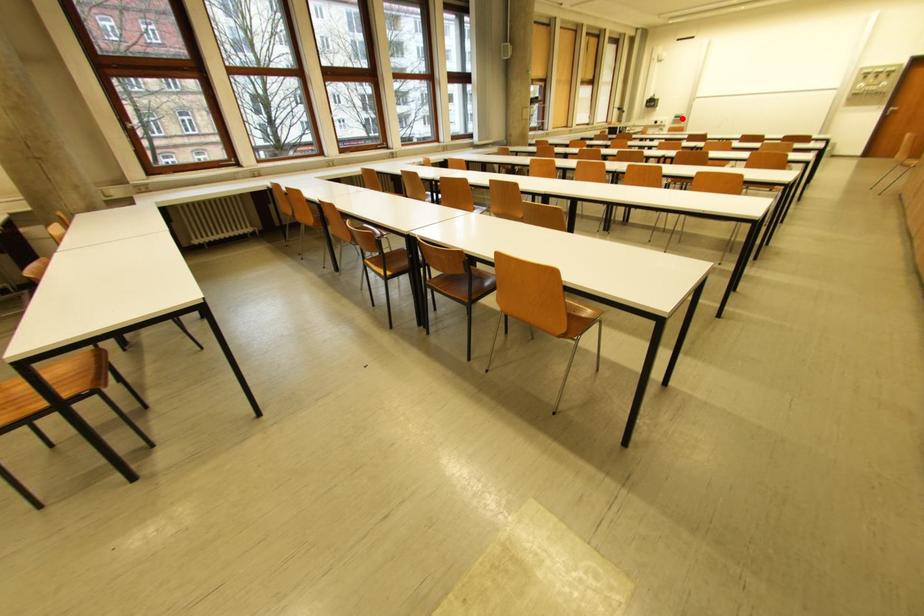
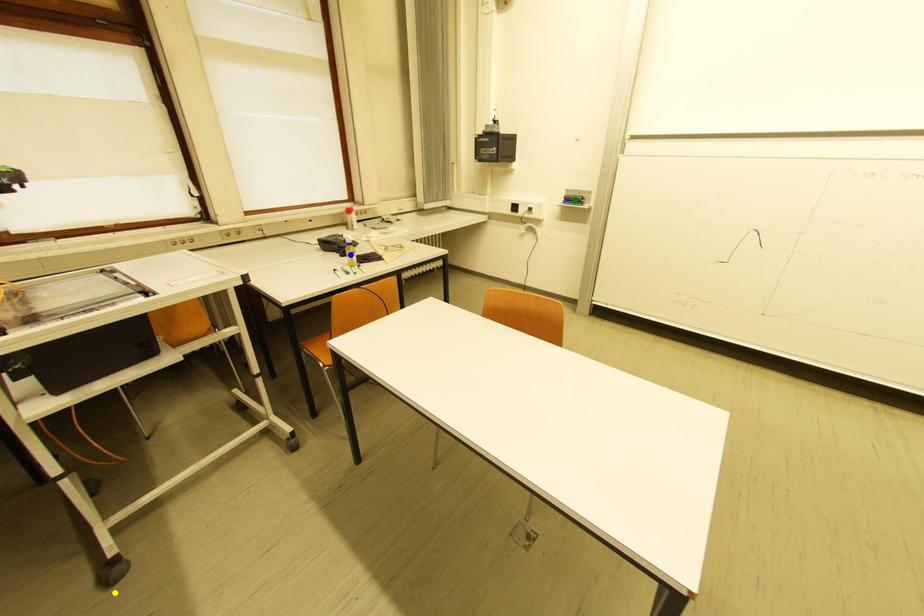
Question: I am providing you with two images of the same scene from different viewpoints. A red point is marked on the first image. You are given multiple points on the second image. Which point in image 2 represents the same 3d spot as the red point in image 1?

Choices:
 (A) yellow point
 (B) green point
 (C) blue point

Answer: (B)